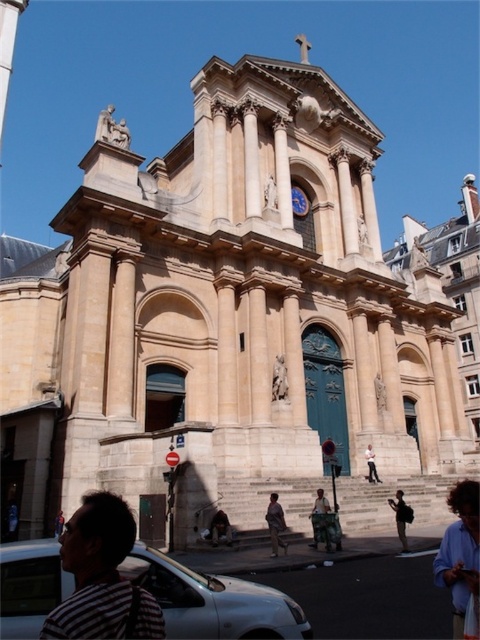
You are a pedestrian standing in front of the church and want to reach the dark gray backpack at lower right without stepping on the matte silver car at lower left. Which direction should you move to avoid it?

The matte silver car at lower left is positioned on the left side of dark gray backpack at lower right, so you should move to the right to avoid stepping on the matte silver car at lower left and reach the dark gray backpack at lower right.

In the scene shown: You are a photographer standing in front of the beige stone church at right and the white cotton shirt at center. You want to capture a photo where both objects are visible in the frame. Which object should you position closer to the left side of the camera frame to ensure both are included?

The beige stone church at right is to the right of the white cotton shirt at center, so to include both in the frame, you should position the white cotton shirt at center closer to the left side of the camera frame.

You are a tailor who needs to determine which jacket requires more fabric to make. Based on the image, which jacket between the dark gray fabric jacket at lower center and the dark brown leather jacket at lower left requires more fabric?

The dark brown leather jacket at lower left requires more fabric because its width is greater than the dark gray fabric jacket at lower center.